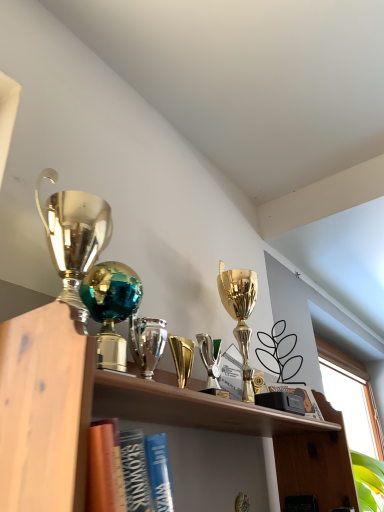
Question: Is black matte book at center bigger or smaller than shiny teal glass globe at center, the 1th trophy viewed from the left?

Choices:
 (A) big
 (B) small

Answer: (B)

Question: Choose the correct answer: Is black matte book at center inside shiny teal glass globe at center, the 1th trophy viewed from the left, or outside it?

Choices:
 (A) outside
 (B) inside

Answer: (A)

Question: Based on their relative distances, which object is farther from the shiny teal glass globe at center, the 1th trophy viewed from the left?

Choices:
 (A) black matte book at center
 (B) shiny silver trophy at center, the 2th trophy positioned from the left

Answer: (A)

Question: Estimate the real-world distances between objects in this image. Which object is farther from the shiny silver trophy at center, which ranks as the first trophy in right-to-left order?

Choices:
 (A) black matte book at center
 (B) shiny teal glass globe at center, the 1th trophy viewed from the left

Answer: (A)